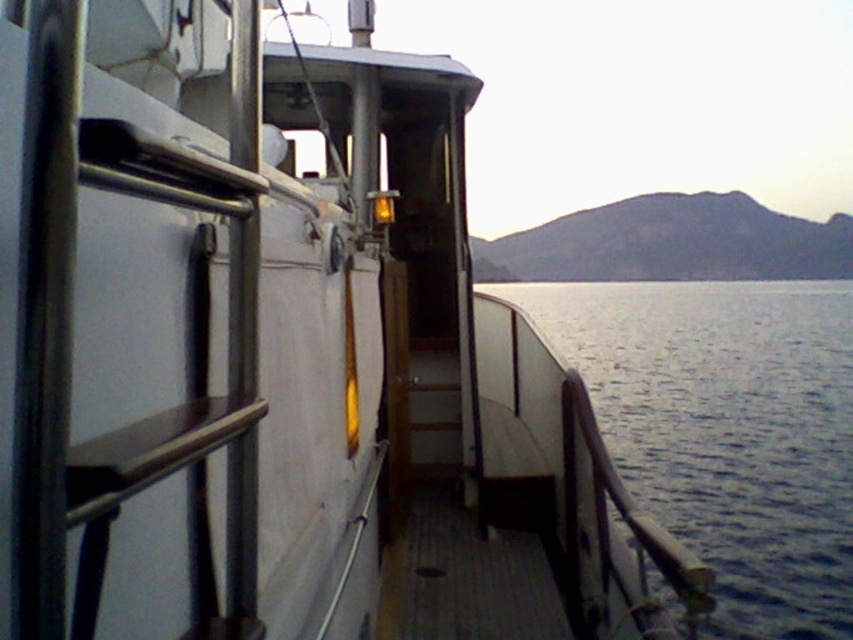
You are standing on the boat deck and want to move from the point closer to the cabin to the point further away from the cabin. Which path should you take between the two points? The points are labeled as point (834, 552) and point (457, 618). Please specify the starting and ending points based on their proximity to the cabin.

Point (834, 552) is closer to the cabin, so you should start at point (834, 552) and move towards point (457, 618) to go away from the cabin.

You are standing on the deck of the boat and want to move from the wooden at center to the blue water at lower right. Which direction should you move in?

You should move to the right since the blue water at lower right is located to the right of the wooden at center.